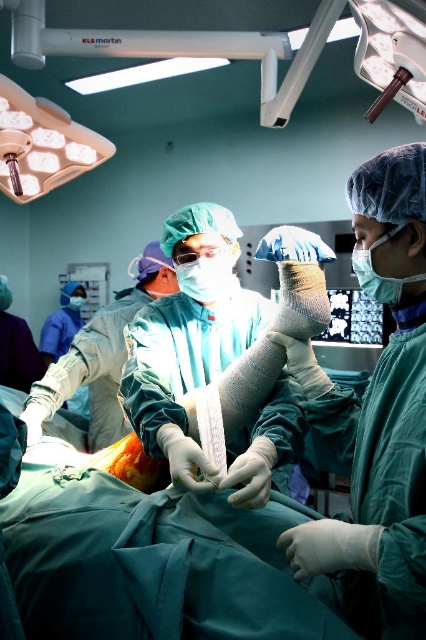
Is white bandaged hand at center shorter than white plastic surgical light at upper center?

Incorrect, white bandaged hand at center's height does not fall short of white plastic surgical light at upper center's.

Between point (178, 449) and point (127, 42), which one is positioned in front?

Point (178, 449)

Who is more forward, (209, 328) or (123, 42)?

Point (123, 42) is in front.

You are a GUI agent. You are given a task and a screenshot of the screen. Output one action in this format:
    pyautogui.click(x=<x>, y=<y>)
    Task: Click on the white bandaged hand at center
    Image resolution: width=426 pixels, height=640 pixels.
    Given the screenshot: What is the action you would take?
    pyautogui.click(x=204, y=360)

Between point (121, 390) and point (164, 288), which one is positioned in front?

Positioned in front is point (121, 390).

Looking at this image, is white bandaged hand at center positioned at the back of white matte surgical gown at center?

No, it is not.

What do you see at coordinates (204, 360) in the screenshot?
I see `white bandaged hand at center` at bounding box center [204, 360].

Locate an element on the screen. This screenshot has width=426, height=640. white bandaged hand at center is located at coordinates (204, 360).

Is white plastic surgical light at upper center wider than white matte surgical gown at center?

Yes.

Is white plastic surgical light at upper center thinner than white matte surgical gown at center?

No, white plastic surgical light at upper center is not thinner than white matte surgical gown at center.

Who is more forward, (34, 8) or (152, 259)?

Point (34, 8) is more forward.

Find the location of a particular element. white plastic surgical light at upper center is located at coordinates (183, 49).